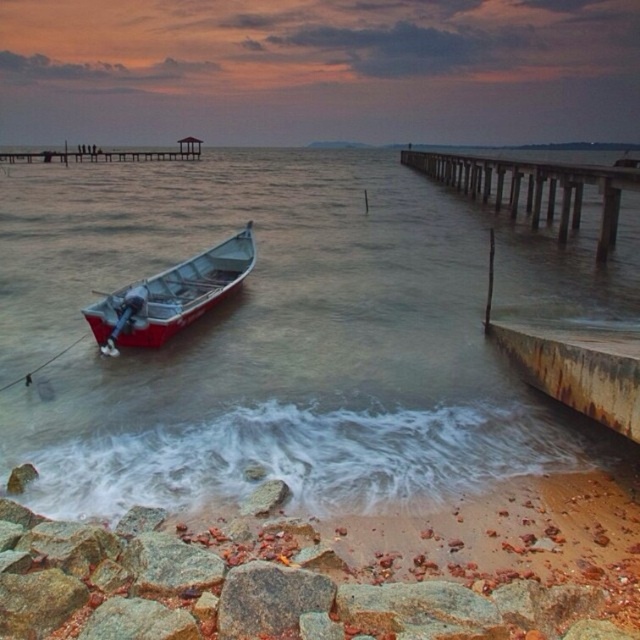
You are a photographer planning to capture the red polished wood boat at left and the clear water at boat left in a single frame. Given that your camera can only focus on one object at a time, which object should you prioritize focusing on to ensure the larger subject is sharp?

The clear water at boat left is bigger than the red polished wood boat at left, so you should prioritize focusing on the clear water at boat left to ensure the larger subject is sharp.